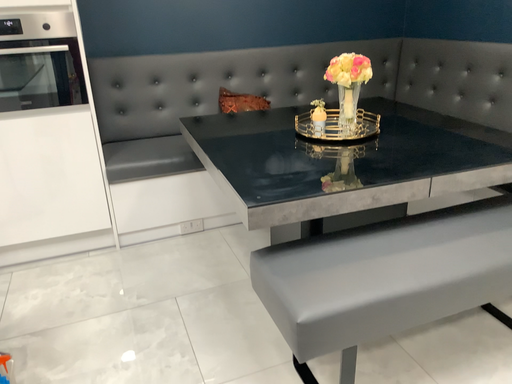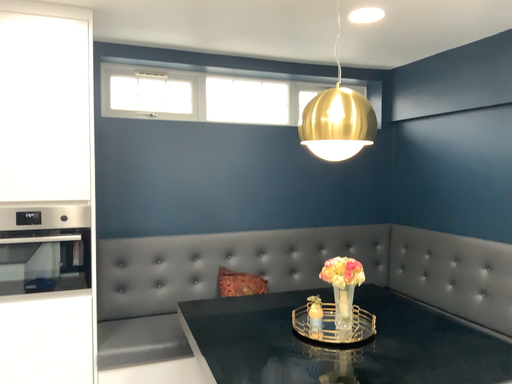
Question: Which way did the camera rotate in the video?

Choices:
 (A) rotated downward
 (B) rotated upward

Answer: (B)